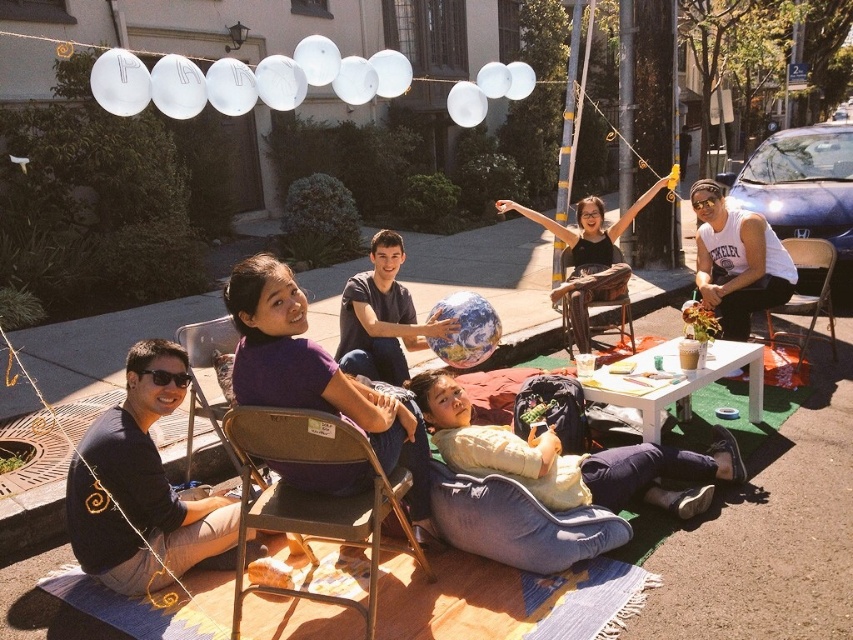
Question: Which point appears closest to the camera in this image?

Choices:
 (A) (496, 204)
 (B) (703, 252)
 (C) (250, 307)
 (D) (222, 326)

Answer: (C)

Question: In this image, where is black matte shirt at lower left located relative to metallic gray chair at lower left?

Choices:
 (A) above
 (B) below

Answer: (B)

Question: Which point is closer to the camera?

Choices:
 (A) metallic silver folding chair at right
 (B) white cotton tank top at upper right
 (C) black matte shirt at lower left
 (D) wooden swing at center

Answer: (C)

Question: Is light yellow fabric at center to the left of white cotton tank top at upper right from the viewer's perspective?

Choices:
 (A) no
 (B) yes

Answer: (B)

Question: Which point appears closest to the camera in this image?

Choices:
 (A) (811, 310)
 (B) (381, 298)

Answer: (B)

Question: Does smooth blue globe at center appear on the left side of white glossy table at center?

Choices:
 (A) yes
 (B) no

Answer: (A)